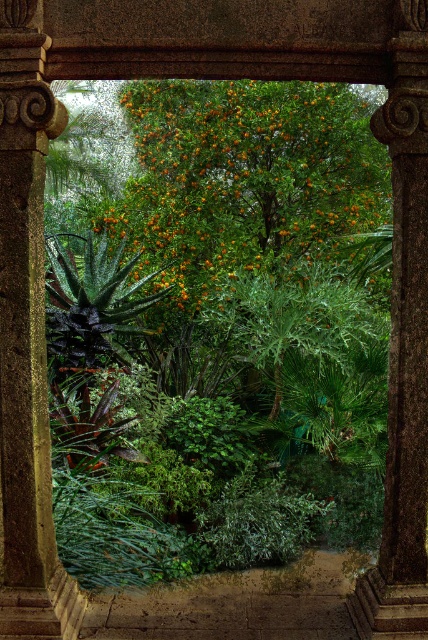
Question: Can you confirm if green leafy orange tree at center is positioned to the right of smooth stone column at left?

Choices:
 (A) no
 (B) yes

Answer: (B)

Question: Is green leafy orange tree at center bigger than smooth stone column at left?

Choices:
 (A) yes
 (B) no

Answer: (A)

Question: Can you confirm if green leafy orange tree at center is smaller than smooth stone column at left?

Choices:
 (A) yes
 (B) no

Answer: (B)

Question: Among these points, which one is nearest to the camera?

Choices:
 (A) (353, 195)
 (B) (47, 541)

Answer: (B)